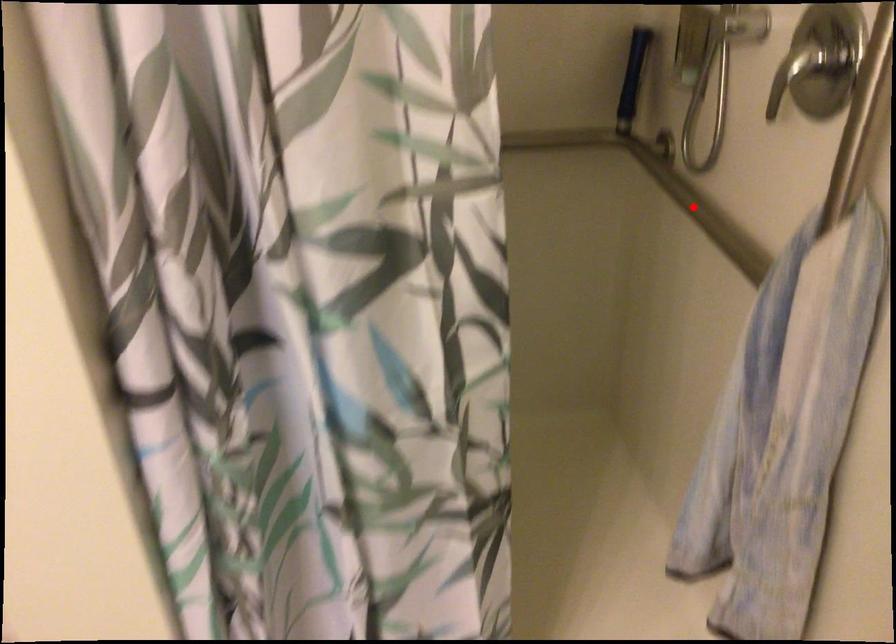
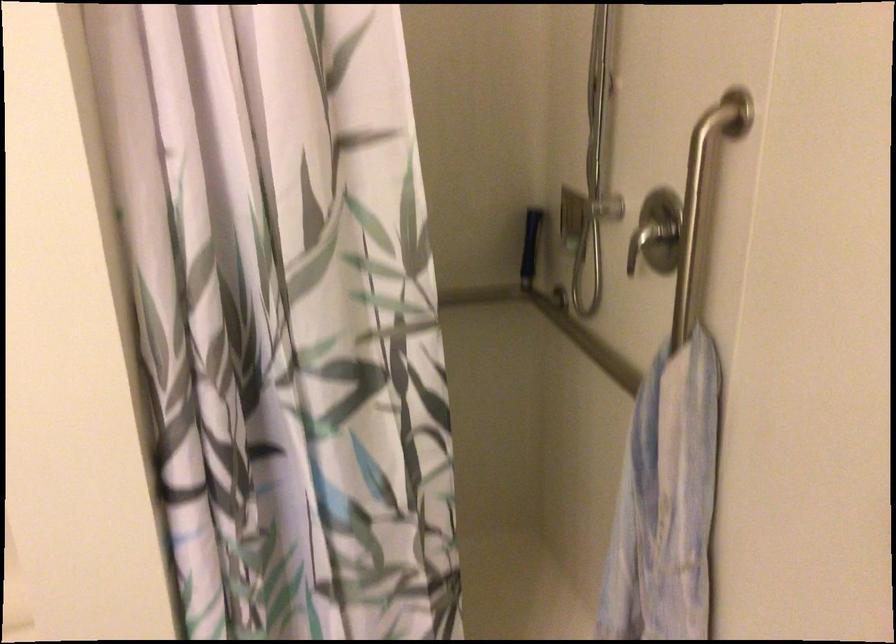
Question: A red point is marked in image1. In image2, is the corresponding 3D point closer to the camera or farther? Reply with the corresponding letter.

Choices:
 (A) The corresponding 3D point is closer.
 (B) The corresponding 3D point is farther.

Answer: (B)